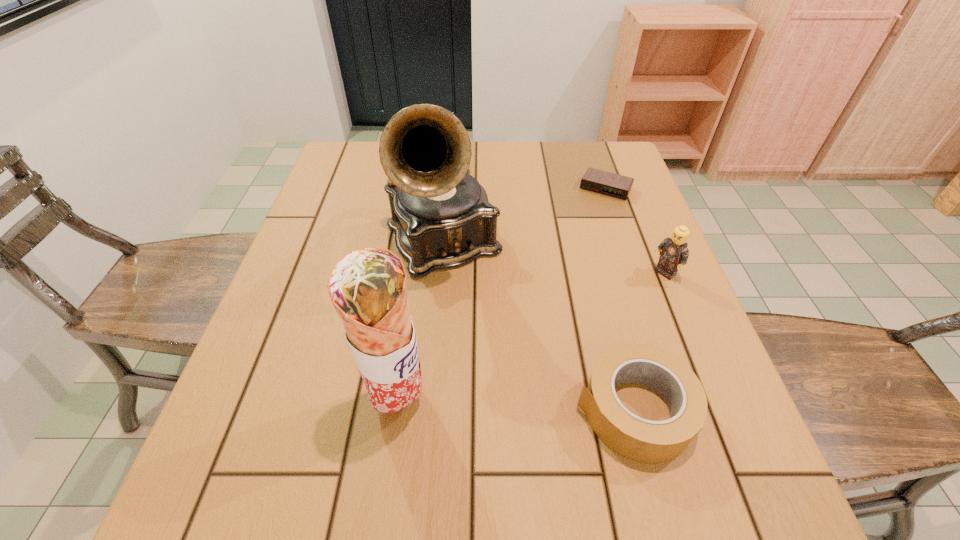
This screenshot has height=540, width=960. What are the coordinates of `burrito located at the near edge` in the screenshot? It's located at (368, 287).

Identify the location of duct tape situated at the near edge. (638, 439).

Identify the location of duct tape at the right edge. This screenshot has width=960, height=540. tap(638, 439).

At what (x,y) coordinates should I click in order to perform the action: click on alarm clock that is at the right edge. Please return your answer as a coordinate pair (x, y). Looking at the image, I should click on (602, 182).

I want to click on Lego present at the right edge, so click(x=674, y=253).

You are a GUI agent. You are given a task and a screenshot of the screen. Output one action in this format:
    pyautogui.click(x=<x>, y=<y>)
    Task: Click on the object that is positioned at the far right corner
    Image resolution: width=960 pixels, height=540 pixels.
    Given the screenshot: What is the action you would take?
    pyautogui.click(x=602, y=182)

Find the location of a particular element. The width and height of the screenshot is (960, 540). object positioned at the near right corner is located at coordinates (638, 439).

Image resolution: width=960 pixels, height=540 pixels. In the image, there is a desktop. Identify the location of vacant area at the far edge. (552, 160).

Locate an element on the screen. The height and width of the screenshot is (540, 960). vacant space at the left edge of the desktop is located at coordinates [308, 246].

This screenshot has height=540, width=960. In the image, there is a desktop. Identify the location of vacant space at the right edge. pyautogui.click(x=680, y=309).